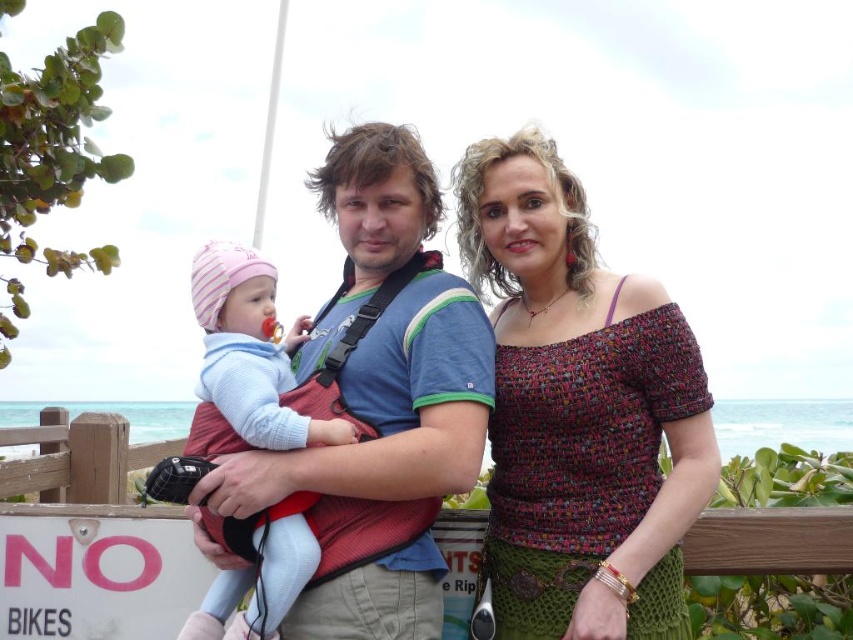
You are a photographer trying to capture a clear shot of both the multicolored woven top at center and the matte blue shirt at center. Since the camera can only focus on one object at a time, which object should you choose to ensure the other remains somewhat in focus given their sizes?

The multicolored woven top at center is larger in size than matte blue shirt at center. To keep both somewhat in focus, you should focus on the larger object, the multicolored woven top at center, as its size allows for a greater depth of field overlap with the smaller matte blue shirt at center.